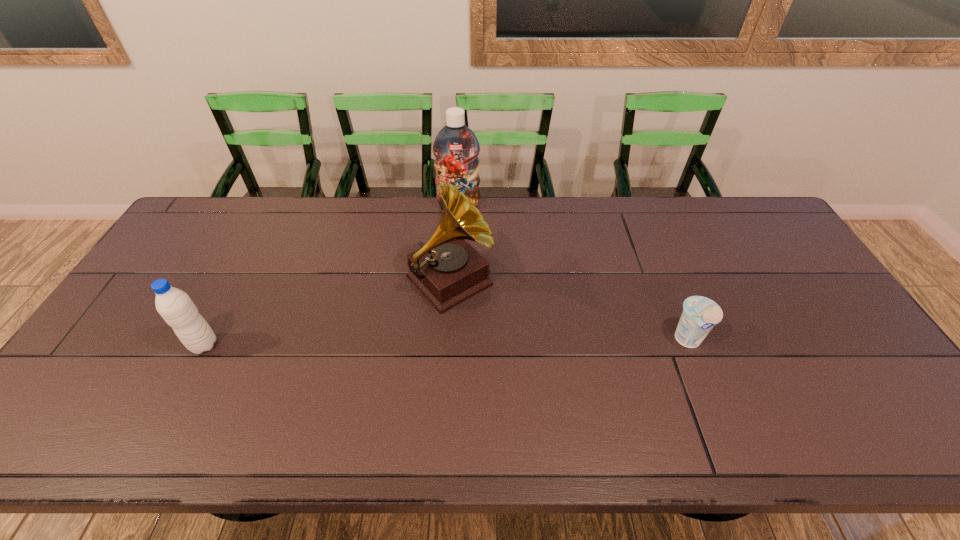
At what (x,y) coordinates should I click in order to perform the action: click on object that is the second closest one to the shortest object. Please return your answer as a coordinate pair (x, y). The height and width of the screenshot is (540, 960). Looking at the image, I should click on (456, 148).

At what (x,y) coordinates should I click in order to perform the action: click on vacant space that satisfies the following two spatial constraints: 1. on the back side of the shampoo; 2. on the right side of the third nearest object. Please return your answer as a coordinate pair (x, y). Looking at the image, I should click on (454, 206).